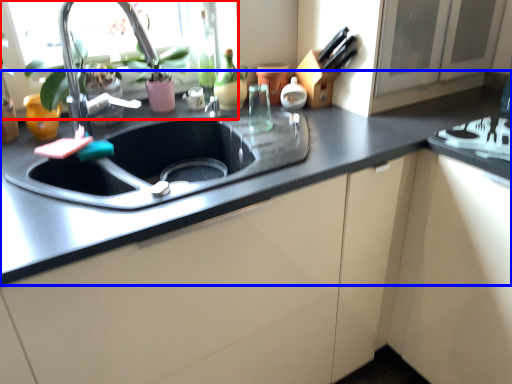
Question: Which object is closer to the camera taking this photo, window screen (highlighted by a red box) or countertop (highlighted by a blue box)?

Choices:
 (A) window screen
 (B) countertop

Answer: (B)